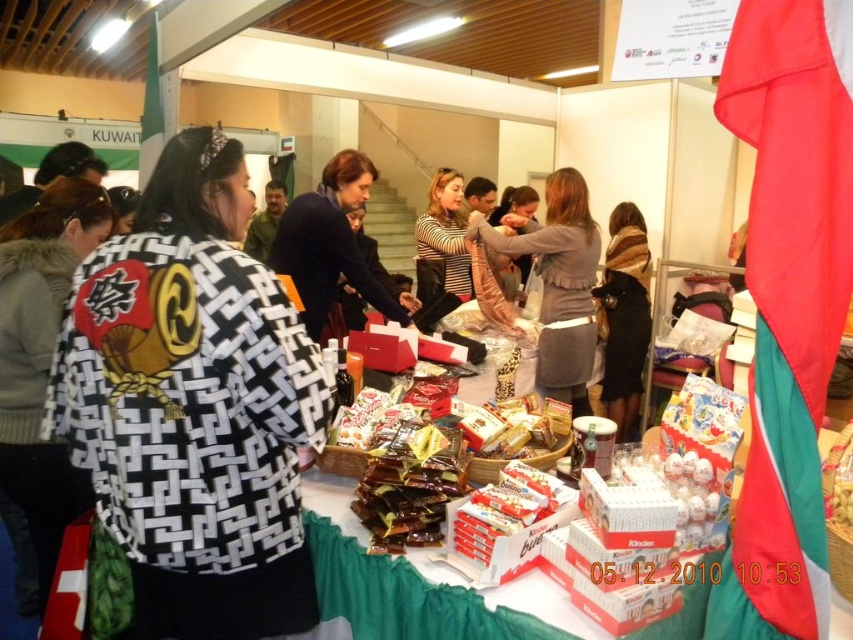
Between point (216, 134) and point (24, 474), which one is positioned in front?

Point (216, 134) is more forward.

Does black and white patterned kimono at center appear under black and white patterned kimono at left?

Actually, black and white patterned kimono at center is above black and white patterned kimono at left.

Who is more forward, (148,595) or (45,573)?

Positioned in front is point (148,595).

Locate an element on the screen. Image resolution: width=853 pixels, height=640 pixels. black and white patterned kimono at center is located at coordinates (194, 404).

Who is higher up, matte black jacket at center or brown wool scarf at center?

matte black jacket at center is higher up.

Does matte black jacket at center have a greater height compared to brown wool scarf at center?

No, matte black jacket at center is not taller than brown wool scarf at center.

Where is `matte black jacket at center`? matte black jacket at center is located at coordinates (331, 244).

Which is behind, point (578, 324) or point (625, 268)?

The point (625, 268) is behind.

You are a GUI agent. You are given a task and a screenshot of the screen. Output one action in this format:
    pyautogui.click(x=<x>, y=<y>)
    Task: Click on the leather jacket at center
    The height and width of the screenshot is (640, 853).
    Given the screenshot: What is the action you would take?
    pyautogui.click(x=556, y=282)